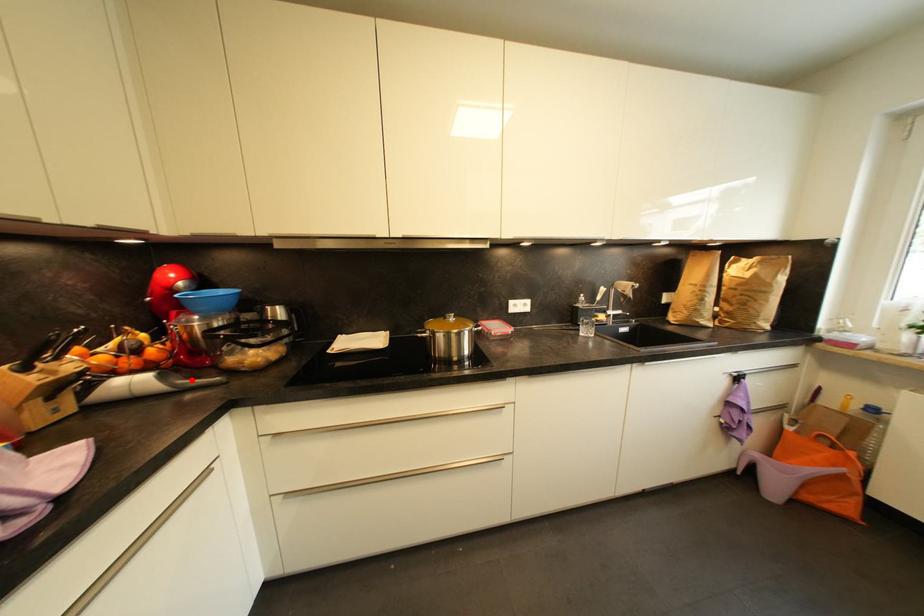
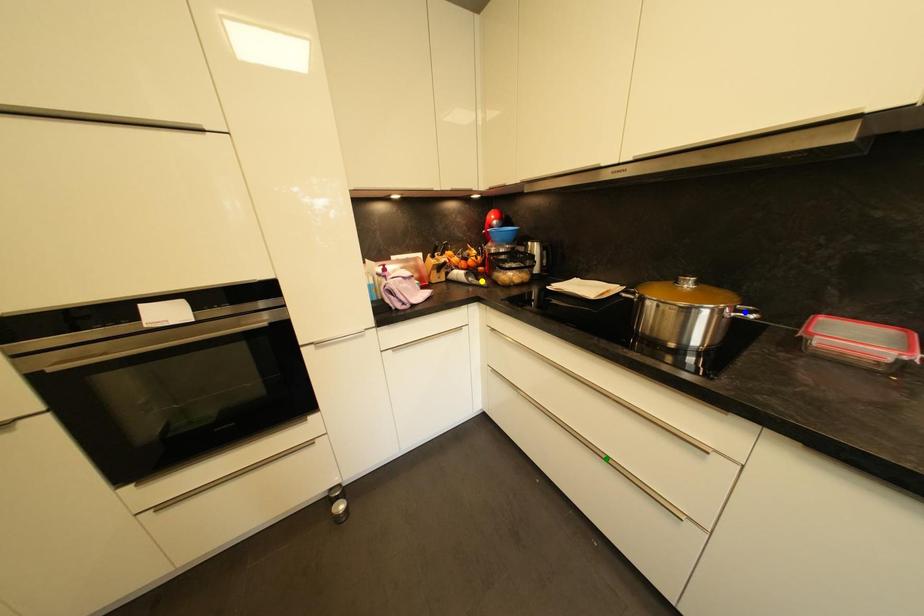
Question: I am providing you with two images of the same scene from different viewpoints. A red point is marked on the first image. You are given multiple points on the second image. Can you choose the point in image 2 that corresponds to the point in image 1?

Choices:
 (A) blue point
 (B) yellow point
 (C) green point

Answer: (B)